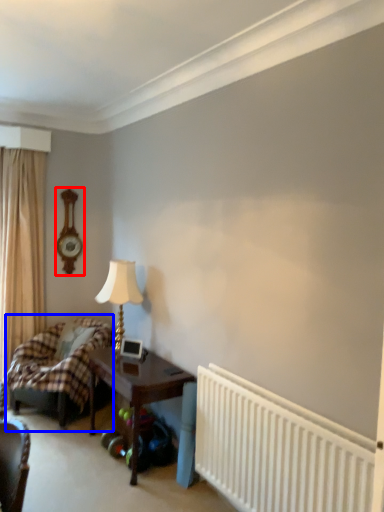
Question: Which of the following is the closest to the observer, clock (highlighted by a red box) or bed (highlighted by a blue box)?

Choices:
 (A) clock
 (B) bed

Answer: (B)